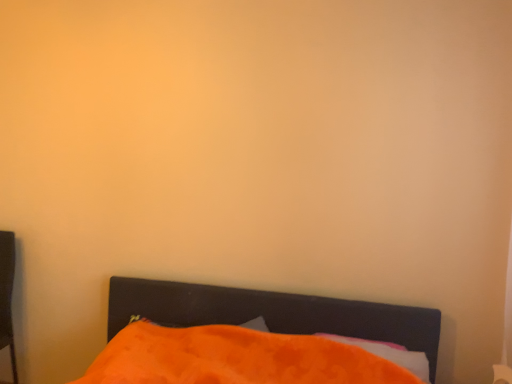
What do you see at coordinates (272, 312) in the screenshot? I see `orange fabric bed at lower center` at bounding box center [272, 312].

In order to click on orange fabric bed at lower center in this screenshot , I will do click(x=272, y=312).

Measure the distance between point (385, 350) and camera.

The depth of point (385, 350) is 6.28 feet.

Describe the element at coordinates (389, 354) in the screenshot. I see `orange fabric pillow at lower center` at that location.

Locate an element on the screen. The height and width of the screenshot is (384, 512). orange fabric pillow at lower center is located at coordinates (389, 354).

Locate an element on the screen. orange fabric bed at lower center is located at coordinates (272, 312).

Does orange fabric pillow at lower center appear on the left side of orange fabric bed at lower center?

No.

Who is more distant, orange fabric pillow at lower center or orange fabric bed at lower center?

orange fabric pillow at lower center is more distant.

Considering the points (383, 351) and (246, 289), which point is in front, point (383, 351) or point (246, 289)?

The point (383, 351) is more forward.

From the image's perspective, which is above, orange fabric pillow at lower center or orange fabric bed at lower center?

From the image's view, orange fabric pillow at lower center is above.

In the scene shown: From a real-world perspective, which object stands above the other?

orange fabric pillow at lower center.

Can you confirm if orange fabric pillow at lower center is thinner than orange fabric bed at lower center?

Correct, the width of orange fabric pillow at lower center is less than that of orange fabric bed at lower center.

Who is taller, orange fabric pillow at lower center or orange fabric bed at lower center?

With more height is orange fabric bed at lower center.

In the scene shown: Considering the sizes of objects orange fabric pillow at lower center and orange fabric bed at lower center in the image provided, who is bigger, orange fabric pillow at lower center or orange fabric bed at lower center?

With larger size is orange fabric bed at lower center.

Is orange fabric bed at lower center a part of orange fabric pillow at lower center?

No, orange fabric bed at lower center is not inside orange fabric pillow at lower center.

Looking at this image, are orange fabric pillow at lower center and orange fabric bed at lower center making contact?

No, orange fabric pillow at lower center is not with orange fabric bed at lower center.

From the picture: Does orange fabric pillow at lower center turn towards orange fabric bed at lower center?

Yes, orange fabric pillow at lower center is aimed at orange fabric bed at lower center.

The width and height of the screenshot is (512, 384). I want to click on bed located below the orange fabric pillow at lower center (from the image's perspective), so click(x=272, y=312).

Is orange fabric bed at lower center to the right of orange fabric pillow at lower center from the viewer's perspective?

In fact, orange fabric bed at lower center is to the left of orange fabric pillow at lower center.

Considering the positions of objects orange fabric bed at lower center and orange fabric pillow at lower center in the image provided, who is in front, orange fabric bed at lower center or orange fabric pillow at lower center?

orange fabric bed at lower center is more forward.

Which is behind, point (370, 323) or point (419, 363)?

Positioned behind is point (370, 323).

From the image's perspective, which one is positioned lower, orange fabric bed at lower center or orange fabric pillow at lower center?

orange fabric bed at lower center appears lower in the image.

From a real-world perspective, is orange fabric bed at lower center under orange fabric pillow at lower center?

Yes, from a real-world perspective, orange fabric bed at lower center is under orange fabric pillow at lower center.

Which object is wider, orange fabric bed at lower center or orange fabric pillow at lower center?

orange fabric bed at lower center is wider.

Who is shorter, orange fabric bed at lower center or orange fabric pillow at lower center?

orange fabric pillow at lower center is shorter.

Based on their sizes in the image, would you say orange fabric bed at lower center is bigger or smaller than orange fabric pillow at lower center?

orange fabric bed at lower center is bigger than orange fabric pillow at lower center.

Would you say orange fabric pillow at lower center is part of orange fabric bed at lower center's contents?

Yes, orange fabric bed at lower center is surrounding orange fabric pillow at lower center.

Is orange fabric bed at lower center beside orange fabric pillow at lower center?

There is a gap between orange fabric bed at lower center and orange fabric pillow at lower center.

Does orange fabric bed at lower center turn towards orange fabric pillow at lower center?

No, orange fabric bed at lower center does not turn towards orange fabric pillow at lower center.

What's the angular difference between orange fabric bed at lower center and orange fabric pillow at lower center's facing directions?

They differ by 3.17 degrees in their facing directions.

This screenshot has height=384, width=512. In order to click on pillow that appears above the orange fabric bed at lower center (from a real-world perspective) in this screenshot , I will do `click(389, 354)`.

There is a orange fabric bed at lower center. Where is `pillow above it (from a real-world perspective)`? This screenshot has height=384, width=512. pillow above it (from a real-world perspective) is located at coordinates (389, 354).

Where is `pillow above the orange fabric bed at lower center (from the image's perspective)`? The image size is (512, 384). pillow above the orange fabric bed at lower center (from the image's perspective) is located at coordinates (389, 354).